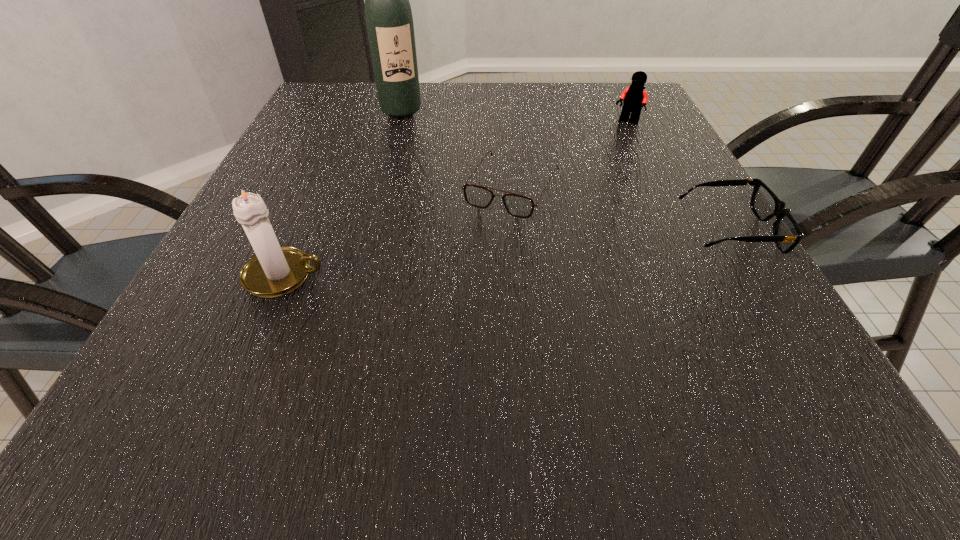
At what (x,y) coordinates should I click in order to perform the action: click on free spot on the desktop that is between the second tallest object and the right sunglasses and is positioned on the front-facing side of the Lego. Please return your answer as a coordinate pair (x, y). The height and width of the screenshot is (540, 960). Looking at the image, I should click on (519, 252).

Locate an element on the screen. vacant space on the desktop that is between the candle holder and the right sunglasses and is positioned on the labeled side of the fourth object from right to left is located at coordinates (472, 256).

Locate an element on the screen. free space on the desktop that is between the candle holder and the right sunglasses and is positioned on the front-facing side of the left sunglasses is located at coordinates (471, 256).